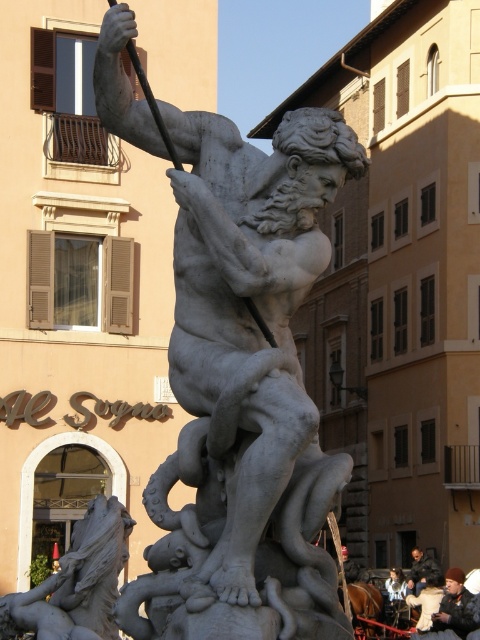
You are an art conservator examining the white marble statue at center. Based on its position coordinates, can you determine if it is placed closer to the left or right side of the display area?

The white marble statue at center is located at point (245, 388), which indicates it is closer to the right side of the display area since the x coordinate is above 0.5.

You are an art curator planning to move the dark brown leather jacket at lower right closer to the white marble statue at center. Based on their current positions, will the jacket be placed above or below the statue after moving it?

The white marble statue at center is currently located above the dark brown leather jacket at lower right. Moving the jacket closer to the statue would place it below the statue since it remains in its lower position relative to the statue.